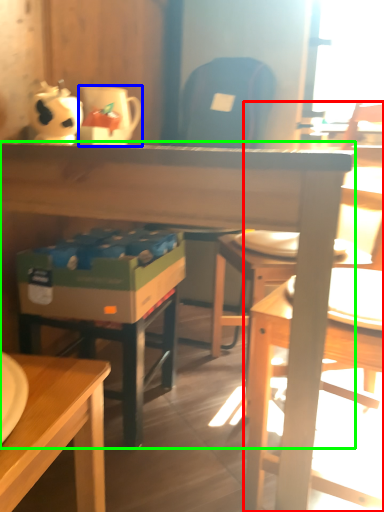
Question: Considering the real-world distances, which object is closest to chair (highlighted by a red box)? coffee cup (highlighted by a blue box) or desk (highlighted by a green box).

Choices:
 (A) coffee cup
 (B) desk

Answer: (B)